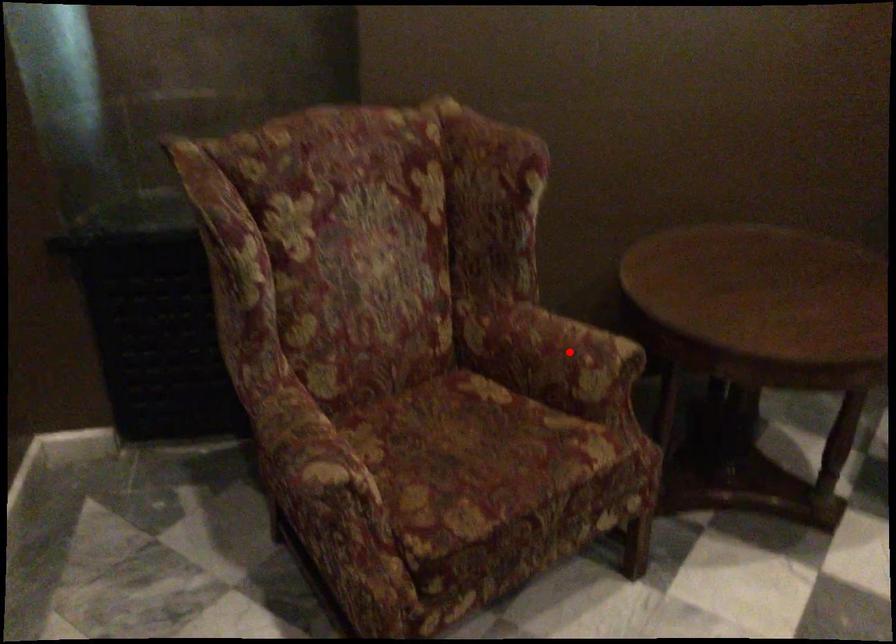
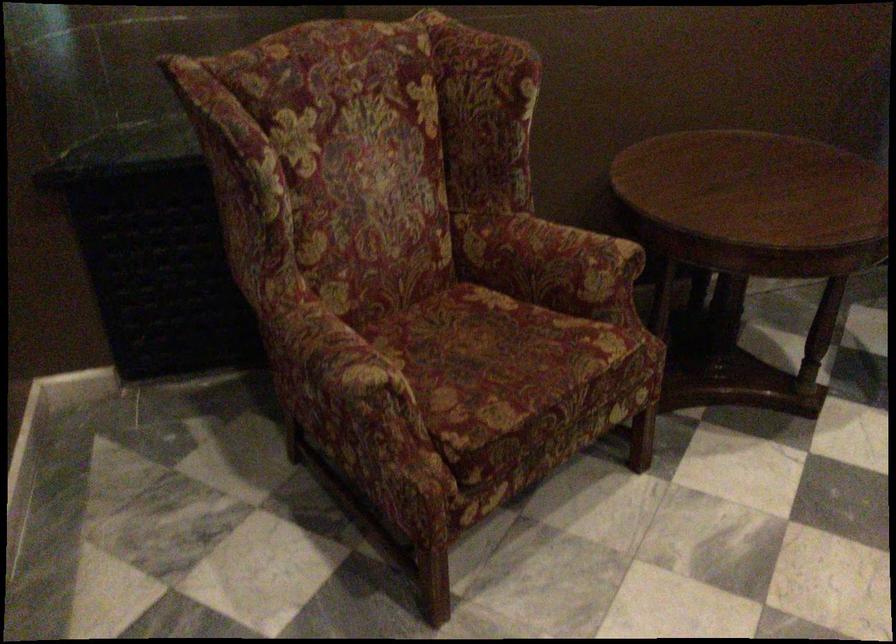
The point at the highlighted location is marked in the first image. Where is the corresponding point in the second image?

(572, 256)